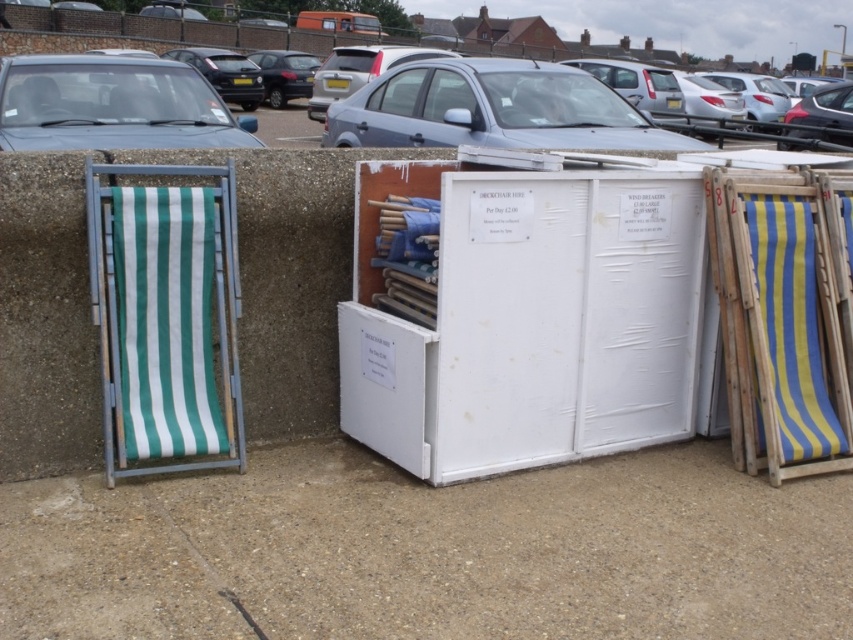
Does point (780, 307) come behind point (492, 67)?

No, it is in front of (492, 67).

Can you confirm if blue striped wood at right is wider than satin silver sedan at upper center?

Incorrect, blue striped wood at right's width does not surpass satin silver sedan at upper center's.

Locate an element on the screen. blue striped wood at right is located at coordinates (782, 317).

Which is behind, point (173, 438) or point (335, 61)?

Point (335, 61)

Does green striped fabric beach chair at left have a lesser height compared to silver metallic car at upper center?

Yes.

This screenshot has height=640, width=853. Describe the element at coordinates (165, 316) in the screenshot. I see `green striped fabric beach chair at left` at that location.

You are a GUI agent. You are given a task and a screenshot of the screen. Output one action in this format:
    pyautogui.click(x=<x>, y=<y>)
    Task: Click on the green striped fabric beach chair at left
    This screenshot has width=853, height=640.
    Given the screenshot: What is the action you would take?
    pyautogui.click(x=165, y=316)

Is point (460, 138) positioned before point (296, 115)?

That is True.

Which is more to the right, satin silver sedan at upper center or matte silver car at upper center?

satin silver sedan at upper center is more to the right.

Does point (421, 60) lie behind point (265, 134)?

That is False.

The width and height of the screenshot is (853, 640). Identify the location of satin silver sedan at upper center. (492, 109).